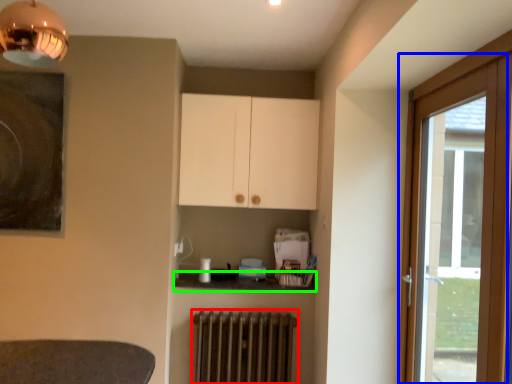
Question: Considering the real-world distances, which object is farthest from radiator (highlighted by a red box)? door (highlighted by a blue box) or counter top (highlighted by a green box)?

Choices:
 (A) door
 (B) counter top

Answer: (A)